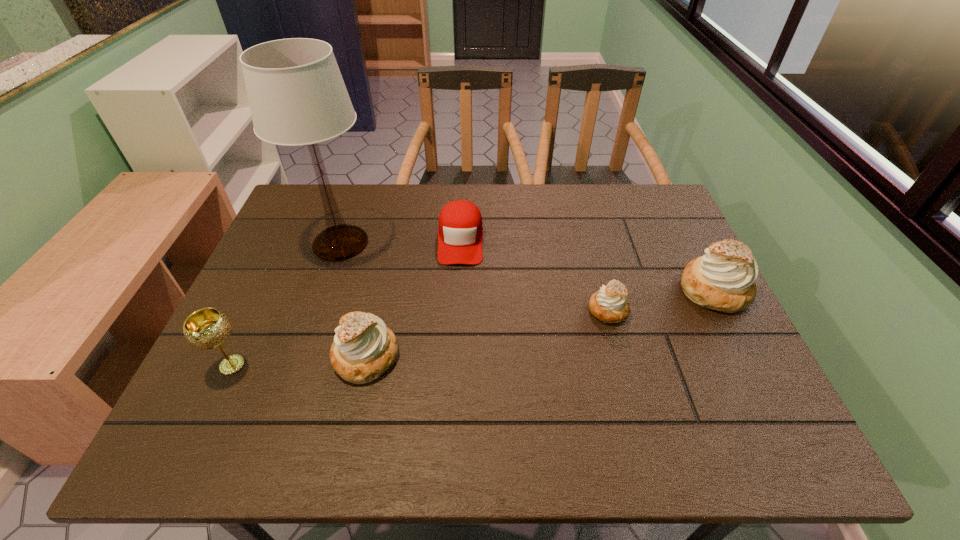
The image size is (960, 540). What are the coordinates of `free space that is in between the tallest object and the baseball cap` in the screenshot? It's located at (400, 241).

This screenshot has height=540, width=960. Identify the location of free space between the rightmost object and the tallest object. (527, 267).

The image size is (960, 540). Find the location of `free space between the fourth object from left to right and the rightmost pastry`. free space between the fourth object from left to right and the rightmost pastry is located at coordinates (588, 265).

I want to click on empty space that is in between the third object from right to left and the chalice, so click(347, 302).

I want to click on vacant area between the table lamp and the rightmost pastry, so click(x=527, y=267).

What are the coordinates of `free area in between the second pastry from right to left and the chalice` in the screenshot? It's located at (420, 338).

The height and width of the screenshot is (540, 960). Identify the location of free space between the rightmost object and the chalice. (473, 328).

What are the coordinates of `empty space that is in between the shortest pastry and the chalice` in the screenshot? It's located at (420, 338).

Where is `object identified as the closest to the chalice`? object identified as the closest to the chalice is located at coordinates (363, 349).

The image size is (960, 540). Find the location of `the closest object relative to the fifth object from left to right`. the closest object relative to the fifth object from left to right is located at coordinates (723, 279).